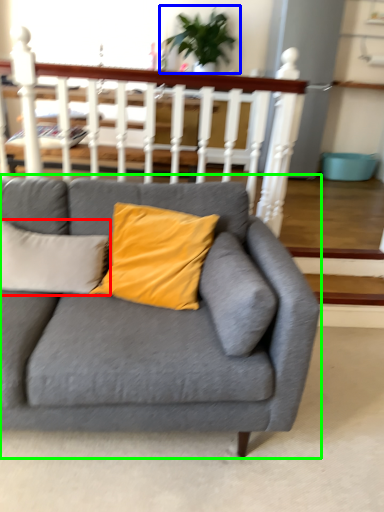
Question: Based on their relative distances, which object is nearer to pillow (highlighted by a red box)? Choose from houseplant (highlighted by a blue box) and studio couch (highlighted by a green box).

Choices:
 (A) houseplant
 (B) studio couch

Answer: (B)